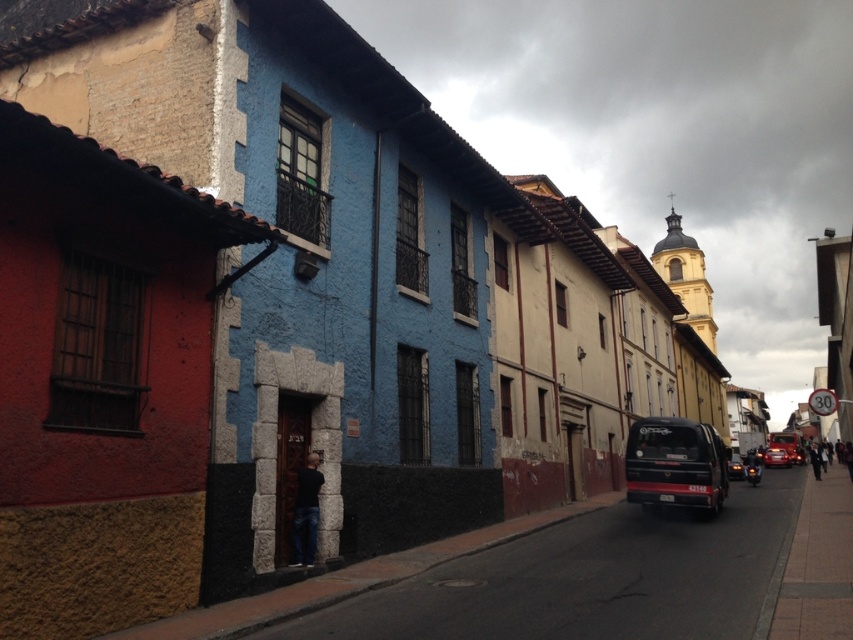
Can you confirm if black matte van at center is taller than shiny black car at center-right?

Indeed, black matte van at center has a greater height compared to shiny black car at center-right.

Is black matte van at center positioned at the back of shiny black car at center-right?

No, it is not.

Where is `black matte van at center`? The image size is (853, 640). black matte van at center is located at coordinates (675, 465).

The image size is (853, 640). I want to click on black matte van at center, so click(x=675, y=465).

Between shiny red car at right and shiny black car at center-right, which one is positioned lower?

shiny red car at right is below.

Does point (782, 464) lie in front of point (737, 474)?

That is False.

Does point (785, 460) lie behind point (732, 467)?

That is True.

Locate an element on the screen. The image size is (853, 640). shiny red car at right is located at coordinates (776, 458).

From the picture: Who is more forward, (809,529) or (766,456)?

Point (809,529)

Is brick sidewalk at lower right in front of shiny red car at right?

Yes, it is in front of shiny red car at right.

Which is in front, point (775, 609) or point (767, 452)?

Point (775, 609)

Identify the location of brick sidewalk at lower right. (814, 564).